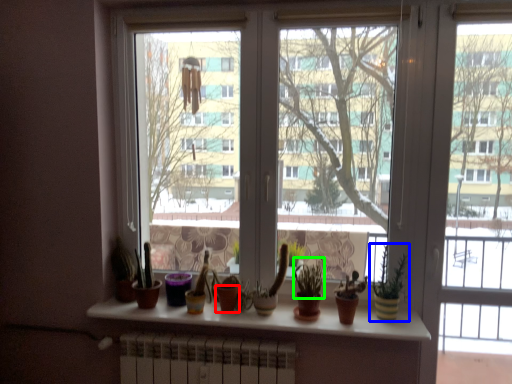
Question: Estimate the real-world distances between objects in this image. Which object is closer to flowerpot (highlighted by a red box), houseplant (highlighted by a blue box) or plant (highlighted by a green box)?

Choices:
 (A) houseplant
 (B) plant

Answer: (B)